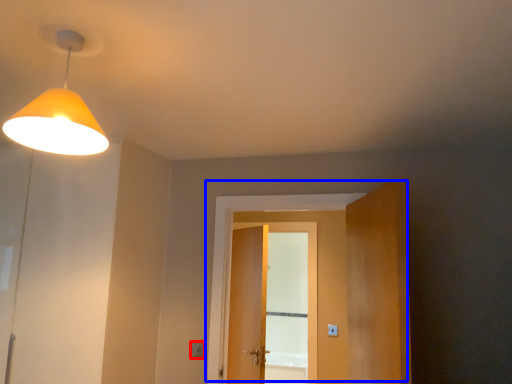
Question: Which of the following is the closest to the observer, light switch (highlighted by a red box) or door (highlighted by a blue box)?

Choices:
 (A) light switch
 (B) door

Answer: (B)